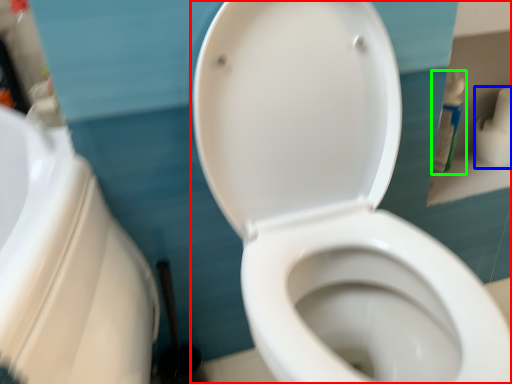
Question: Which object is positioned farthest from toilet (highlighted by a red box)? Select from toilet paper (highlighted by a blue box) and cleaning product (highlighted by a green box).

Choices:
 (A) toilet paper
 (B) cleaning product

Answer: (A)